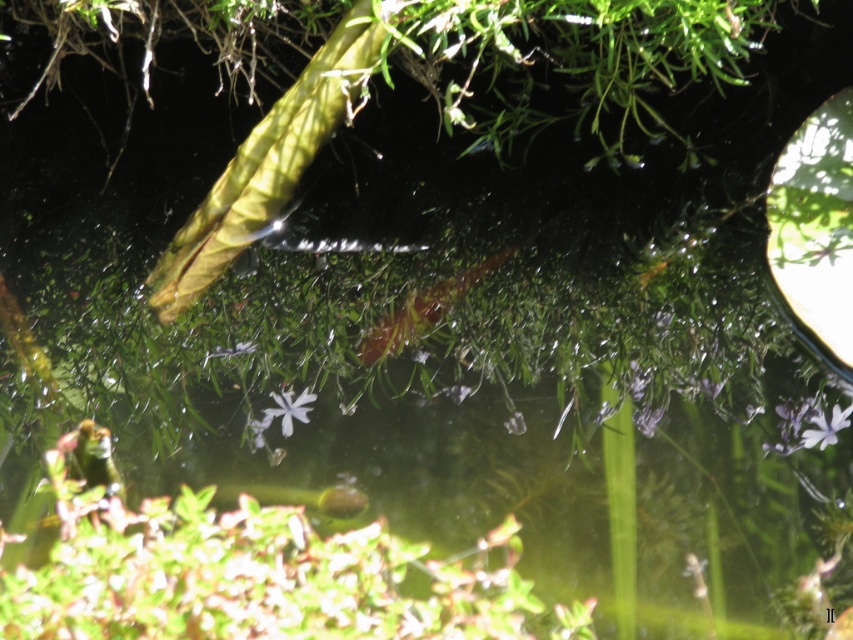
Question: Can you confirm if purple matte flower at center-right is positioned above white matte flower at center?

Choices:
 (A) yes
 (B) no

Answer: (B)

Question: Which point is farther from the camera taking this photo?

Choices:
 (A) (294, 413)
 (B) (820, 435)

Answer: (A)

Question: Is purple matte flower at center-right wider than white matte flower at center?

Choices:
 (A) no
 (B) yes

Answer: (A)

Question: Can you confirm if purple matte flower at center-right is thinner than white matte flower at center?

Choices:
 (A) yes
 (B) no

Answer: (A)